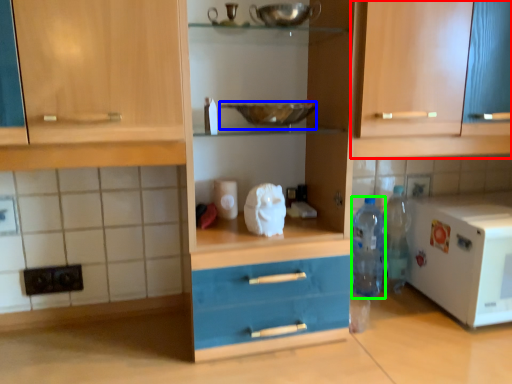
Question: Which object is the closest to the cabinetry (highlighted by a red box)? Choose among these: bowl (highlighted by a blue box) or bottle (highlighted by a green box).

Choices:
 (A) bowl
 (B) bottle

Answer: (A)